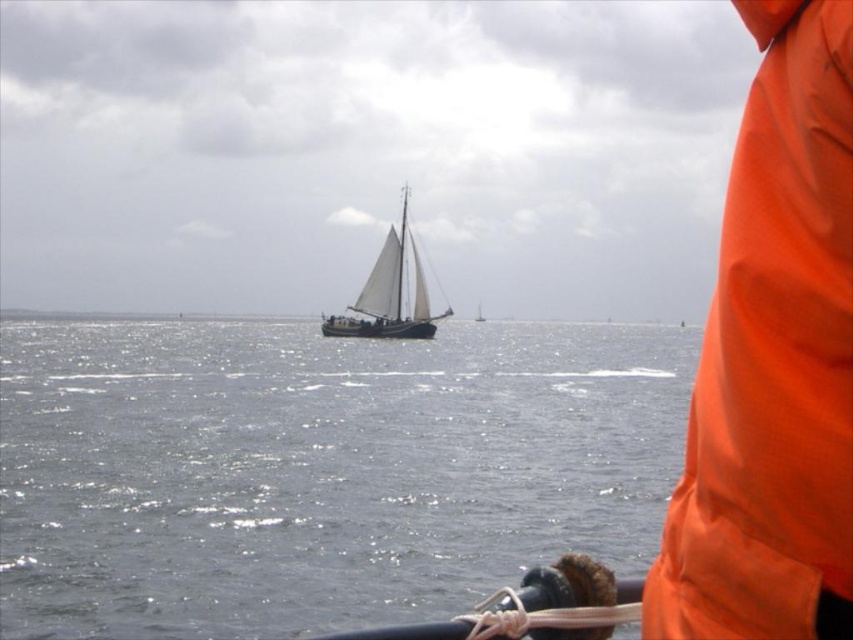
Question: From the image, what is the correct spatial relationship of wooden sailboat at center in relation to white canvas sailboat at center?

Choices:
 (A) above
 (B) below

Answer: (A)

Question: Which of these objects is positioned farthest from the glistening water at center?

Choices:
 (A) wooden sailboat at center
 (B) white canvas sailboat at center
 (C) orange fabric at right

Answer: (B)

Question: Is wooden sailboat at center positioned in front of white canvas sailboat at center?

Choices:
 (A) yes
 (B) no

Answer: (A)

Question: Among these objects, which one is farthest from the camera?

Choices:
 (A) orange fabric at right
 (B) white canvas sailboat at center

Answer: (B)

Question: Does orange fabric at right have a larger size compared to white canvas sailboat at center?

Choices:
 (A) yes
 (B) no

Answer: (A)

Question: Which object is closer to the camera taking this photo?

Choices:
 (A) white canvas sailboat at center
 (B) glistening water at center
 (C) orange fabric at right
 (D) wooden sailboat at center

Answer: (C)